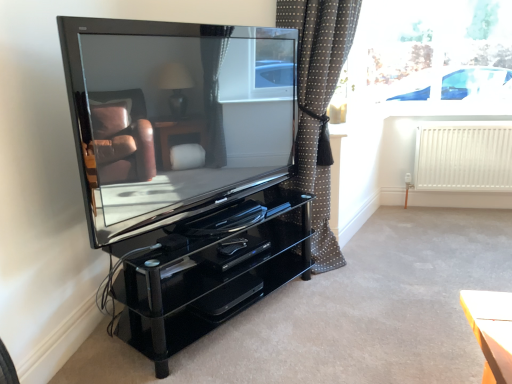
The height and width of the screenshot is (384, 512). I want to click on free space on the front side of polka dot fabric curtain at center, so pos(353,294).